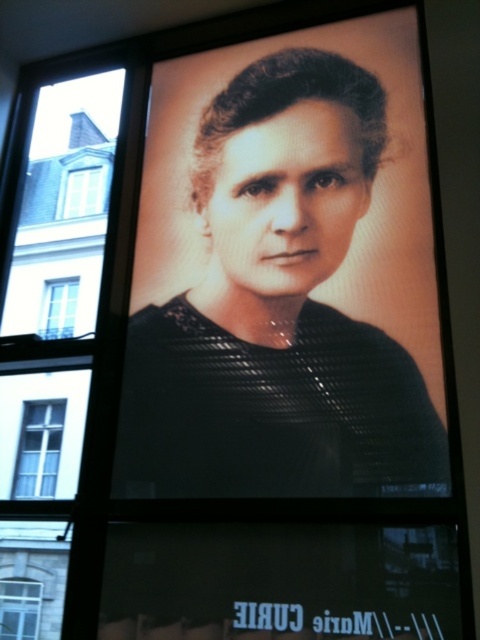
You are standing in front of the portrait of Marie Curie. There is a point marked at coordinate (38, 449). What object is located at that point?

The point at coordinate (38, 449) marks the white glass window at left.

You are standing in a room with a framed portrait of Marie Curie on the wall. You notice two windows, the clear glass window at lower left and the white glass window at upper left. Which window is closer to you?

The clear glass window at lower left is closer to you because it is in front of the white glass window at upper left.

You are an interior designer assessing the lighting in a room with a large framed portrait of Marie Curie. The room has a white glass window at left and a clear glass window at upper left. Which window allows more natural light into the room?

The clear glass window at upper left allows more natural light into the room since it is smaller in height compared to the white glass window at left, but the type of glass might affect light transmission. However, based on the description provided, the height difference suggests the white glass window at left is taller and could let in more light due to its larger size.